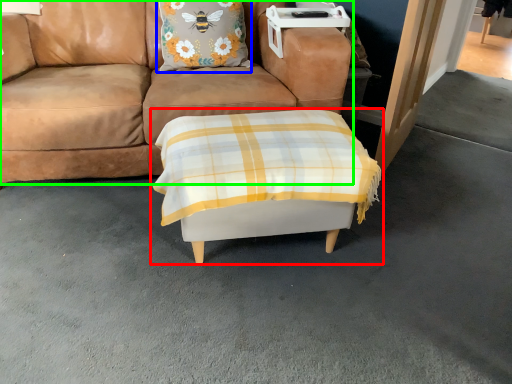
Question: Which object is positioned closest to table (highlighted by a red box)? Select from pillow (highlighted by a blue box) and studio couch (highlighted by a green box).

Choices:
 (A) pillow
 (B) studio couch

Answer: (B)